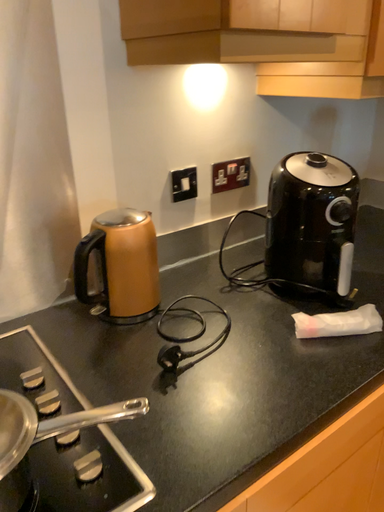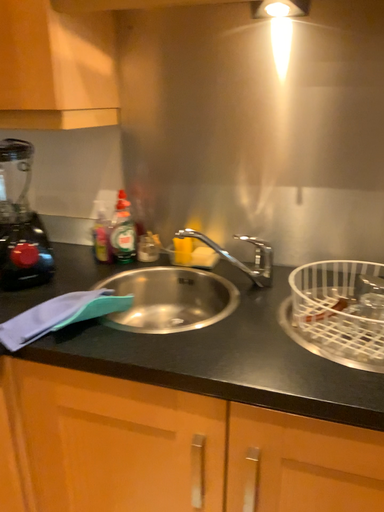
Question: How did the camera likely rotate when shooting the video?

Choices:
 (A) rotated right
 (B) rotated left

Answer: (A)